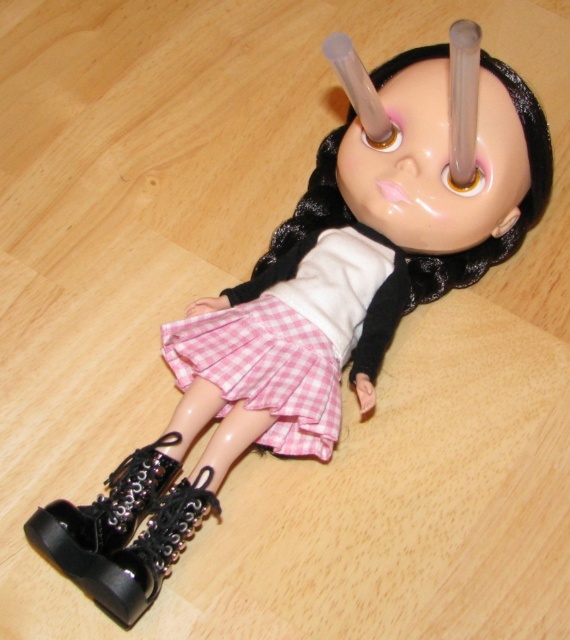
Looking at this image, is pink checkered skirt at center shorter than black leather boot at lower left?

A: Incorrect, pink checkered skirt at center's height does not fall short of black leather boot at lower left's.

Is point (325, 413) closer to viewer compared to point (174, 493)?

No, (325, 413) is behind (174, 493).

This screenshot has height=640, width=570. Describe the element at coordinates (296, 336) in the screenshot. I see `pink checkered skirt at center` at that location.

Locate an element on the screen. The image size is (570, 640). pink checkered skirt at center is located at coordinates (296, 336).